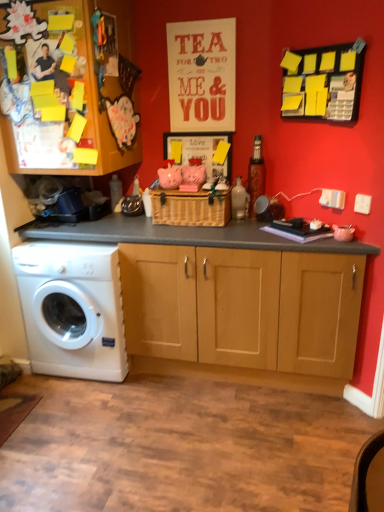
Find the location of a particular element. Image resolution: width=384 pixels, height=512 pixels. blank space situated above yellow sticky notes at upper right (from a real-world perspective) is located at coordinates (327, 38).